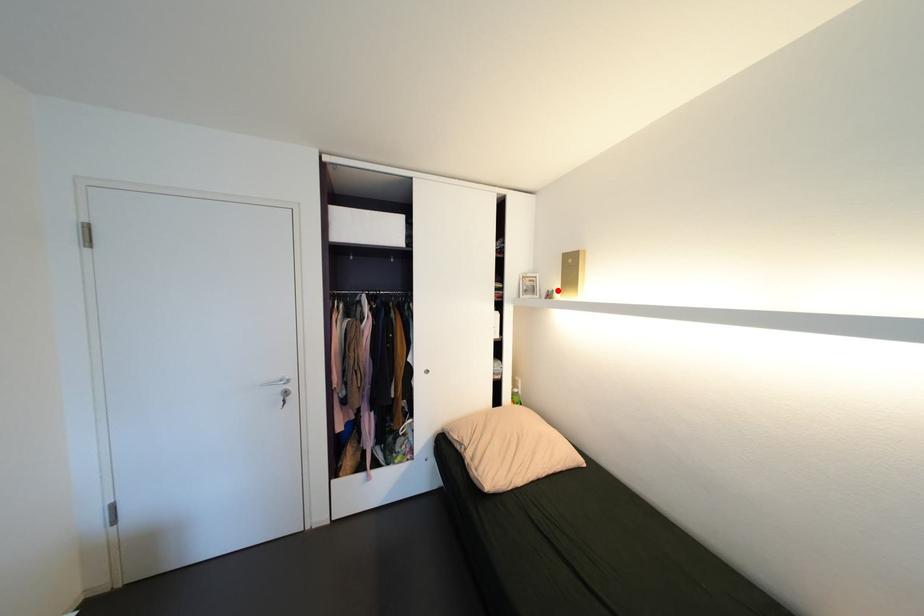
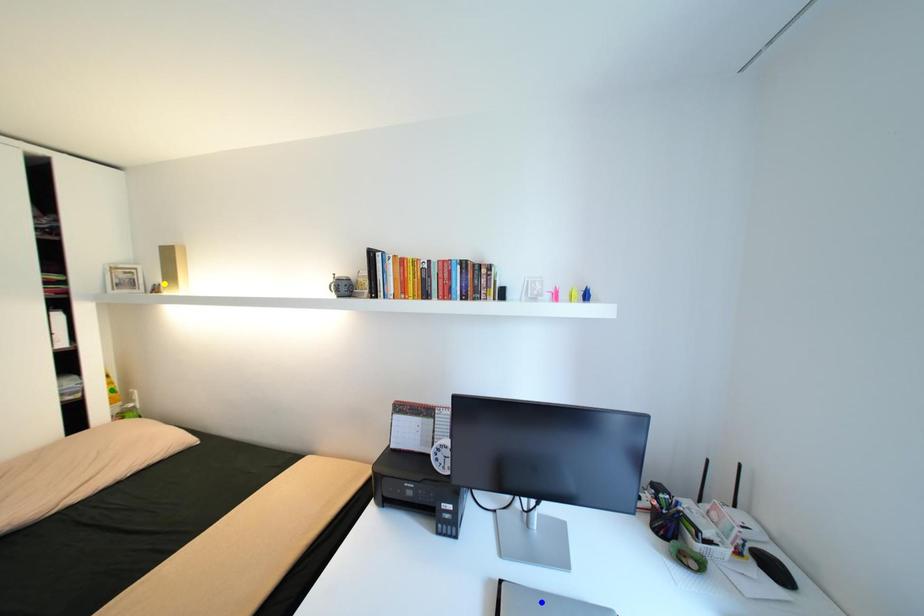
Question: I am providing you with two images of the same scene from different viewpoints. A red point is marked on the first image. You are given multiple points on the second image. In image 2, which mark is for the same physical point as the one in image 1?

Choices:
 (A) green point
 (B) yellow point
 (C) blue point

Answer: (B)